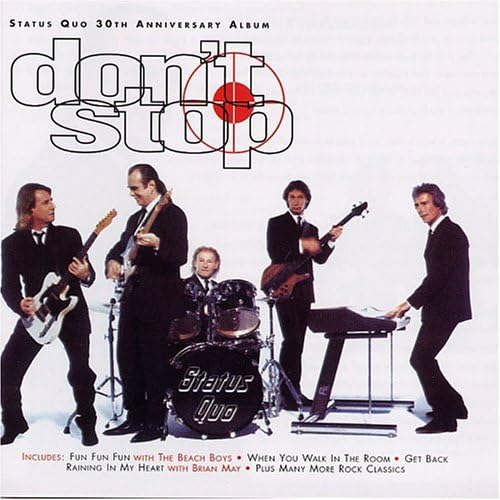
This screenshot has width=500, height=500. Find the location of `keyboard`. keyboard is located at coordinates point(358,320).